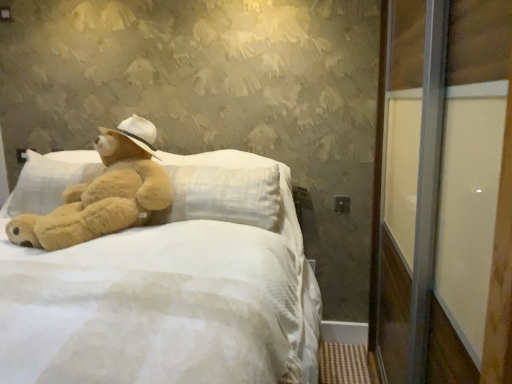
Question: Is soft white fabric bed at center to the left or to the right of transparent glass screen door at right in the image?

Choices:
 (A) left
 (B) right

Answer: (A)

Question: Is soft white fabric bed at center situated inside transparent glass screen door at right or outside?

Choices:
 (A) outside
 (B) inside

Answer: (A)

Question: Estimate the real-world distances between objects in this image. Which object is closer to the transparent glass screen door at right?

Choices:
 (A) fuzzy beige teddy bear at left
 (B) soft white fabric bed at center

Answer: (B)

Question: Which is nearer to the soft white fabric bed at center?

Choices:
 (A) fuzzy beige teddy bear at left
 (B) transparent glass screen door at right

Answer: (A)